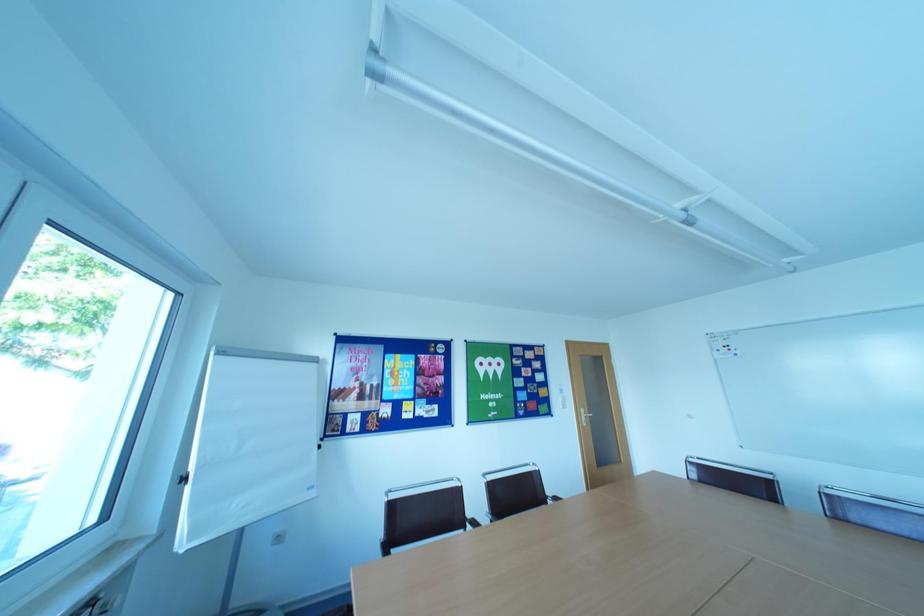
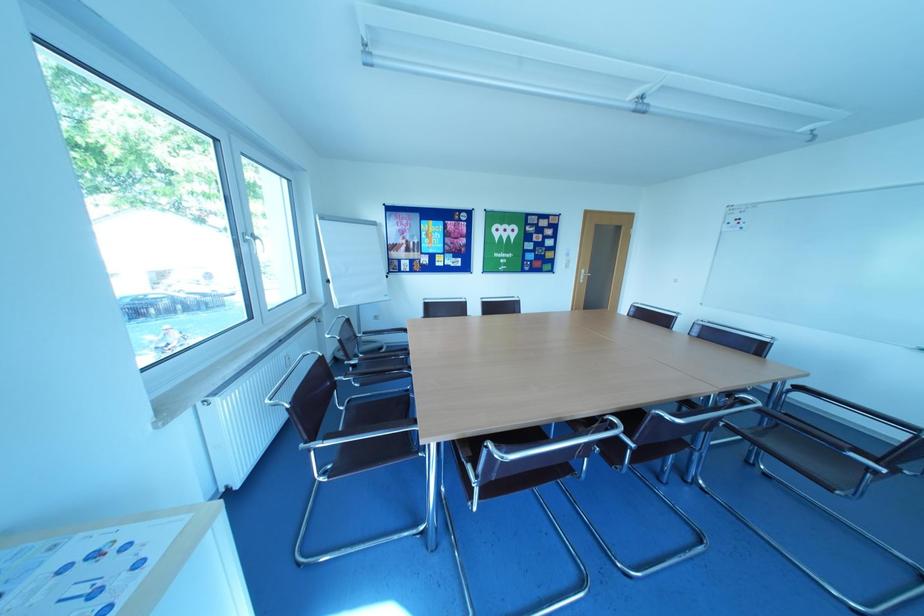
Question: The first image is from the beginning of the video and the second image is from the end. How did the camera likely rotate when shooting the video?

Choices:
 (A) Left
 (B) Right
 (C) Up
 (D) Down

Answer: (D)